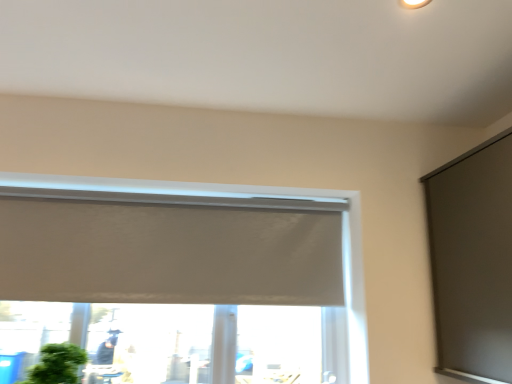
Question: Based on their sizes in the image, would you say matte gray screen at right is bigger or smaller than green matte houseplant at lower left?

Choices:
 (A) small
 (B) big

Answer: (B)

Question: Relative to green matte houseplant at lower left, is matte gray screen at right in front or behind?

Choices:
 (A) front
 (B) behind

Answer: (A)

Question: Based on their relative distances, which object is farther from the green matte houseplant at lower left?

Choices:
 (A) matte gray screen at right
 (B) white matte window at center

Answer: (A)

Question: Based on their relative distances, which object is nearer to the green matte houseplant at lower left?

Choices:
 (A) matte gray screen at right
 (B) white matte window at center

Answer: (B)